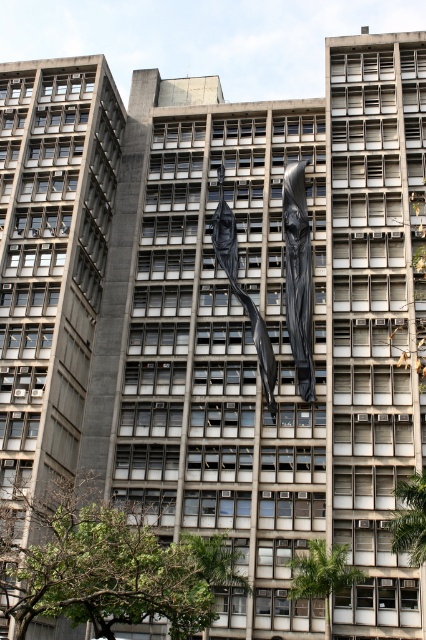
You are standing at the camera position and want to take a photo of the black glossy statue at center. The statue is 61.25 meters away. Your camera has a maximum zoom range of 50 meters. Can you capture the entire statue in your photo without moving closer?

The black glossy statue at center is 61.25 meters away from the camera, which exceeds the camera maximum zoom range of 50 meters. Therefore, you cannot capture the entire statue in your photo without moving closer.

You are an architect reviewing the building design. You notice the black glossy statue at center and the black matte sculpture at center. Which one is placed higher up in the structure?

The black glossy statue at center is positioned over the black matte sculpture at center, so it is placed higher up in the structure.